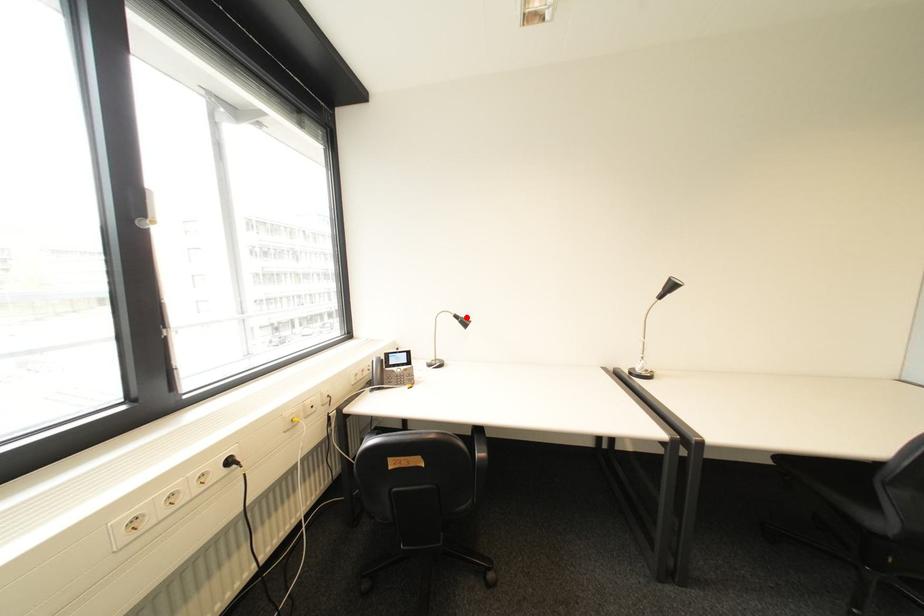
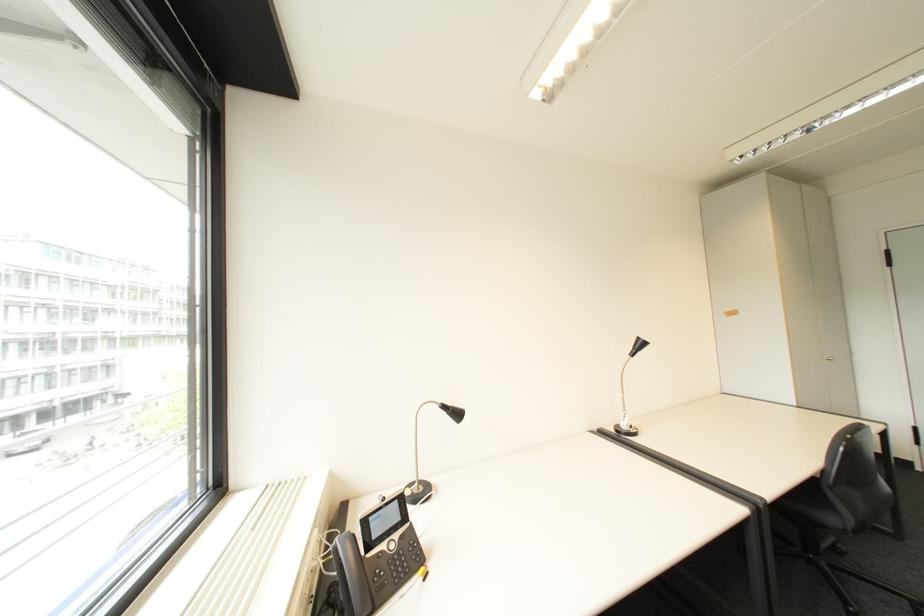
Find the pixel in the second image that matches the highlighted location in the first image.

(455, 407)